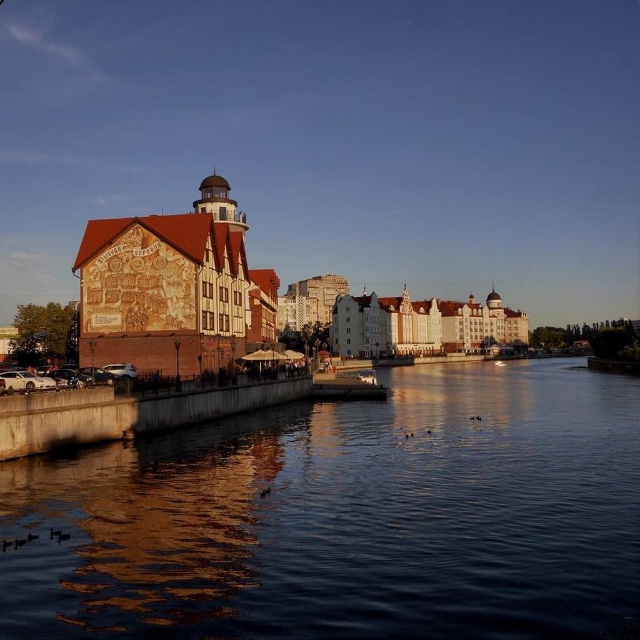
Looking at this image, you are a delivery drone carrying a package that needs to be delivered to the brick building at left. However, you must avoid flying over the dark water at center to prevent any potential accidents. Given that your drone has a maximum horizontal flight distance of 60 meters before needing to recharge, will you be able to safely deliver the package without recharging?

The distance between the dark water at center and the brick building at left is 61.99 meters. Since your drone can only fly 60 meters before needing to recharge, you will not be able to safely deliver the package without recharging as the required distance exceeds the drone s maximum range.

You are a photographer planning to take a photo of the dark water at center and the brick building at left. Which object should you focus on first if you want to capture both in sharp focus without adjusting your camera settings?

The dark water at center is not as tall as the brick building at left, so you should focus on the brick building at left first since it is closer to the camera. This will ensure that both objects remain in focus due to the depth of field overlapping between them.

You are a tourist standing on the riverside walkway and want to take a photo of the brick building at left and the dark water at center. Based on their positions, where should you position yourself to capture both in the frame?

Since the dark water at center is located below the brick building at left, you should position yourself so that the brick building at left is framed above the dark water at center to include both in the photo.